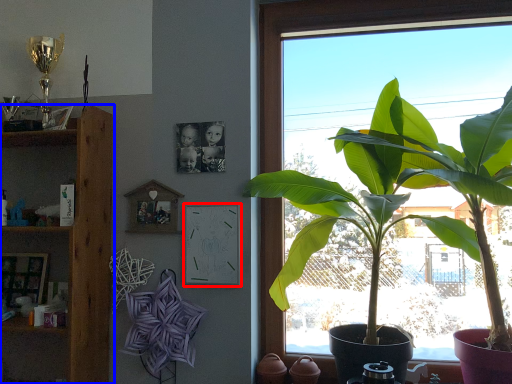
Question: Which object appears closest to the camera in this image, picture frame (highlighted by a red box) or shelf (highlighted by a blue box)?

Choices:
 (A) picture frame
 (B) shelf

Answer: (B)